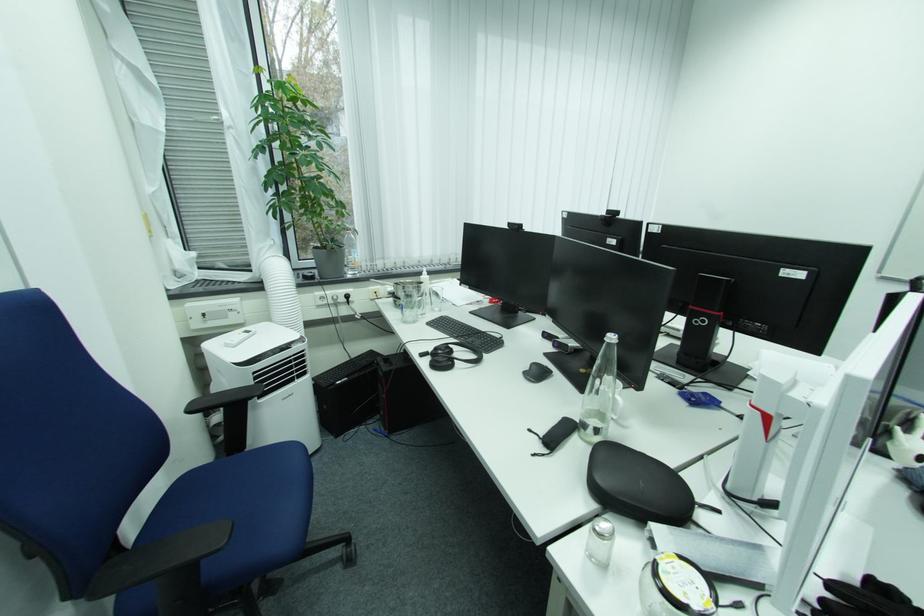
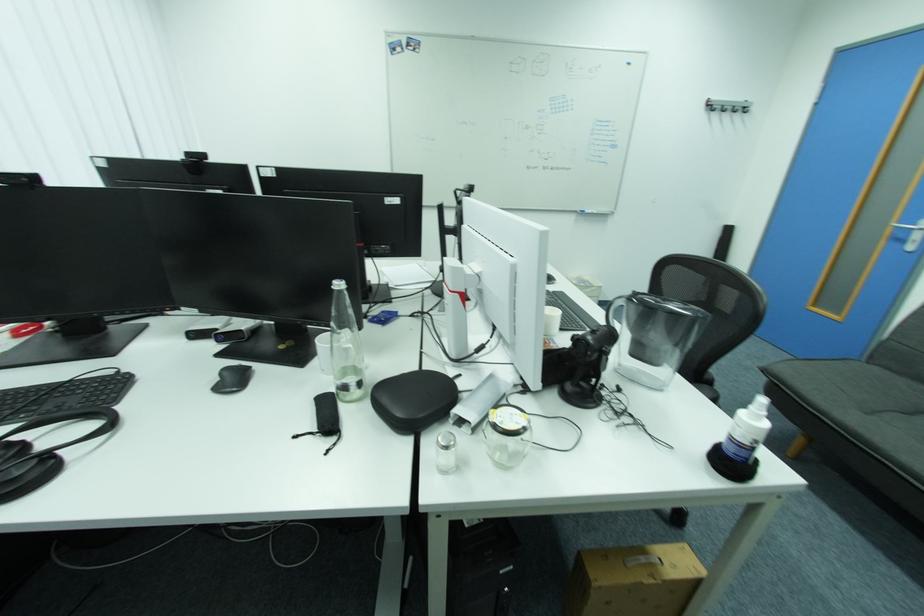
Find the pixel in the second image that matches the point at 457,352 in the first image.

(29, 447)